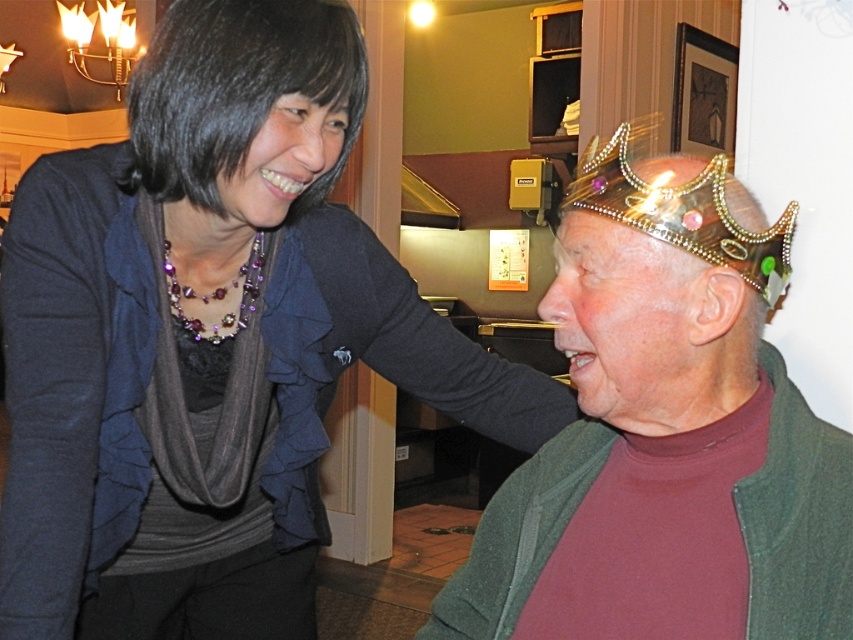
Question: Can you confirm if shiny metallic crown at right is smaller than black fabric head at upper left?

Choices:
 (A) yes
 (B) no

Answer: (B)

Question: Which of the following is the closest to the observer?

Choices:
 (A) matte black scarf at upper left
 (B) shiny metallic crown at right
 (C) gold glittery tiara at upper center

Answer: (B)

Question: Can you confirm if black fabric head at upper left is positioned to the right of gold glittery tiara at upper center?

Choices:
 (A) yes
 (B) no

Answer: (B)

Question: Can you confirm if shiny metallic crown at right is positioned to the left of black fabric head at upper left?

Choices:
 (A) yes
 (B) no

Answer: (B)

Question: Estimate the real-world distances between objects in this image. Which object is closer to the shiny metallic crown at right?

Choices:
 (A) matte black scarf at upper left
 (B) gold glittery tiara at upper center
 (C) black fabric head at upper left

Answer: (B)

Question: Which point is farther to the camera?

Choices:
 (A) black fabric head at upper left
 (B) shiny metallic crown at right
 (C) matte black scarf at upper left

Answer: (A)